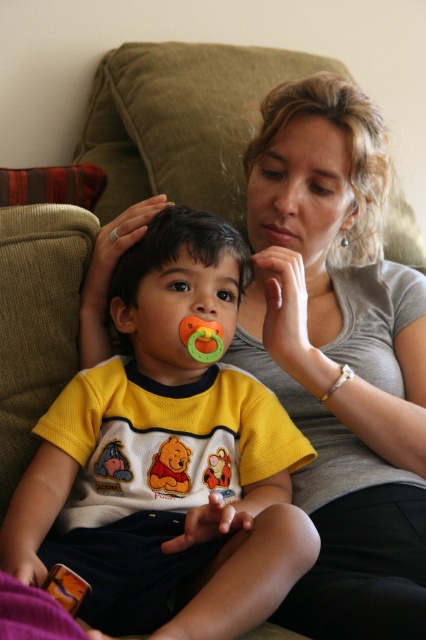
Is rubber/soft pacifier at center to the right of yellow fabric winnie the pooh plush at center from the viewer's perspective?

In fact, rubber/soft pacifier at center is to the left of yellow fabric winnie the pooh plush at center.

Locate an element on the screen. rubber/soft pacifier at center is located at coordinates (201, 339).

In order to click on rubber/soft pacifier at center in this screenshot , I will do `click(201, 339)`.

Is point (129, 611) closer to viewer compared to point (149, 470)?

Yes, point (129, 611) is in front of point (149, 470).

The height and width of the screenshot is (640, 426). Describe the element at coordinates (157, 451) in the screenshot. I see `yellow cotton shirt at center` at that location.

Image resolution: width=426 pixels, height=640 pixels. Identify the location of yellow cotton shirt at center. (157, 451).

How distant is matte gray shirt at center from orange rubber teething ring at center?

matte gray shirt at center and orange rubber teething ring at center are 17.16 inches apart.

Is matte gray shirt at center taller than orange rubber teething ring at center?

Indeed, matte gray shirt at center has a greater height compared to orange rubber teething ring at center.

This screenshot has width=426, height=640. What do you see at coordinates (340, 358) in the screenshot?
I see `matte gray shirt at center` at bounding box center [340, 358].

Locate an element on the screen. This screenshot has height=640, width=426. matte gray shirt at center is located at coordinates (340, 358).